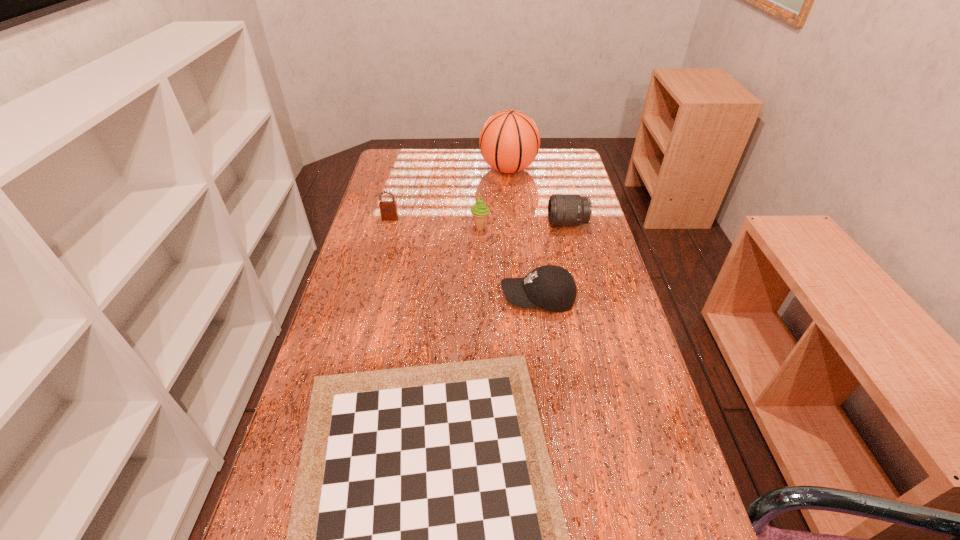
Locate an element on the screen. Image resolution: width=960 pixels, height=540 pixels. object that is at the far right corner is located at coordinates (509, 141).

You are a GUI agent. You are given a task and a screenshot of the screen. Output one action in this format:
    pyautogui.click(x=<x>, y=<y>)
    Task: Click on the free space at the far edge
    
    Given the screenshot: What is the action you would take?
    pyautogui.click(x=459, y=165)

Locate an element on the screen. vacant area at the left edge of the desktop is located at coordinates (378, 223).

Where is `vacant area at the right edge of the desktop`? vacant area at the right edge of the desktop is located at coordinates (622, 335).

In the image, there is a desktop. Where is `free space at the far right corner`? free space at the far right corner is located at coordinates (576, 162).

Where is `free spot between the fifth farthest object and the farthest object`? free spot between the fifth farthest object and the farthest object is located at coordinates (523, 234).

Where is `free space between the padlock and the baseball cap`? free space between the padlock and the baseball cap is located at coordinates (464, 258).

At what (x,y) coordinates should I click in order to perform the action: click on empty space that is in between the telephoto lens and the second nearest object. Please return your answer as a coordinate pair (x, y). The image size is (960, 540). Looking at the image, I should click on (553, 261).

Locate an element on the screen. This screenshot has width=960, height=540. free area in between the telephoto lens and the basketball is located at coordinates (538, 196).

The height and width of the screenshot is (540, 960). What are the coordinates of `empty space that is in between the padlock and the basketball` in the screenshot? It's located at (449, 194).